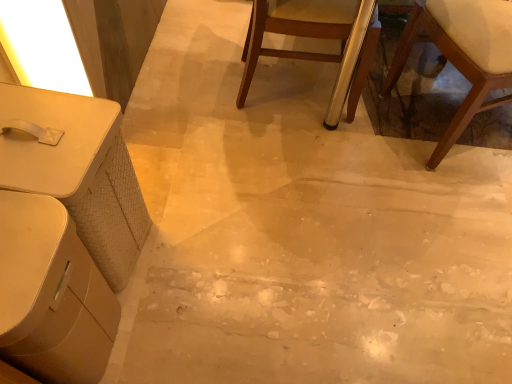
Locate an element on the screen. The height and width of the screenshot is (384, 512). wooden chair at center, marked as the 1th chair in a left-to-right arrangement is located at coordinates (295, 30).

What do you see at coordinates (78, 171) in the screenshot?
I see `white matte table at left, which is counted as the 1th table, starting from the top` at bounding box center [78, 171].

You are a GUI agent. You are given a task and a screenshot of the screen. Output one action in this format:
    pyautogui.click(x=<x>, y=<y>)
    Task: Click on the white matte table at left, which is counted as the 1th table, starting from the top
    This screenshot has height=384, width=512.
    Given the screenshot: What is the action you would take?
    pyautogui.click(x=78, y=171)

Locate an element on the screen. white glossy table at lower left, the second table positioned from the top is located at coordinates (51, 294).

In order to face white glossy table at lower left, the second table positioned from the top, should I rotate leftwards or rightwards?

To align with it, rotate left about 30.422°.

You are a GUI agent. You are given a task and a screenshot of the screen. Output one action in this format:
    pyautogui.click(x=<x>, y=<y>)
    Task: Click on the wooden chair at center, marked as the 1th chair in a left-to-right arrangement
    
    Given the screenshot: What is the action you would take?
    pyautogui.click(x=295, y=30)

Is wooden chair with white cushion at lower right, which is counted as the second chair, starting from the left, in contact with white matte table at left, the second table positioned from the bottom?

No, wooden chair with white cushion at lower right, which is counted as the second chair, starting from the left, is not next to white matte table at left, the second table positioned from the bottom.

Considering the sizes of objects wooden chair with white cushion at lower right, which is counted as the second chair, starting from the left, and white matte table at left, the second table positioned from the bottom, in the image provided, who is smaller, wooden chair with white cushion at lower right, which is counted as the second chair, starting from the left, or white matte table at left, the second table positioned from the bottom,?

Smaller between the two is white matte table at left, the second table positioned from the bottom.

Looking at this image, how different are the orientations of wooden chair with white cushion at lower right, positioned as the first chair in right-to-left order, and white matte table at left, which is counted as the 1th table, starting from the top, in degrees?

The angle between the facing direction of wooden chair with white cushion at lower right, positioned as the first chair in right-to-left order, and the facing direction of white matte table at left, which is counted as the 1th table, starting from the top, is 151 degrees.

Considering the positions of points (402, 37) and (39, 92), is point (402, 37) farther from camera compared to point (39, 92)?

That is True.

Between white matte table at left, the second table positioned from the bottom, and wooden chair with white cushion at lower right, which is counted as the second chair, starting from the left, which one appears on the right side from the viewer's perspective?

wooden chair with white cushion at lower right, which is counted as the second chair, starting from the left.

What's the angular difference between white matte table at left, the second table positioned from the bottom, and wooden chair with white cushion at lower right, positioned as the first chair in right-to-left order,'s facing directions?

The angular difference between white matte table at left, the second table positioned from the bottom, and wooden chair with white cushion at lower right, positioned as the first chair in right-to-left order, is 151 degrees.

Looking at the image, does white matte table at left, the second table positioned from the bottom, seem bigger or smaller compared to wooden chair with white cushion at lower right, positioned as the first chair in right-to-left order?

white matte table at left, the second table positioned from the bottom, is smaller than wooden chair with white cushion at lower right, positioned as the first chair in right-to-left order.

In the scene shown: Is white matte table at left, which is counted as the 1th table, starting from the top, not inside wooden chair with white cushion at lower right, positioned as the first chair in right-to-left order?

Yes, white matte table at left, which is counted as the 1th table, starting from the top, is not within wooden chair with white cushion at lower right, positioned as the first chair in right-to-left order.

From a real-world perspective, is wooden chair with white cushion at lower right, which is counted as the second chair, starting from the left, positioned under wooden chair at center, the 2th chair when ordered from right to left, based on gravity?

No, from a real-world perspective, wooden chair with white cushion at lower right, which is counted as the second chair, starting from the left, is not below wooden chair at center, the 2th chair when ordered from right to left.

Based on the photo, is wooden chair with white cushion at lower right, which is counted as the second chair, starting from the left, not close to wooden chair at center, marked as the 1th chair in a left-to-right arrangement?

wooden chair with white cushion at lower right, which is counted as the second chair, starting from the left, is near wooden chair at center, marked as the 1th chair in a left-to-right arrangement, not far away.

Does point (468, 58) come behind point (341, 41)?

No.

From a real-world perspective, is white matte table at left, the second table positioned from the bottom, physically above white glossy table at lower left, the second table positioned from the top?

Actually, white matte table at left, the second table positioned from the bottom, is physically below white glossy table at lower left, the second table positioned from the top, in the real world.

Would you say white matte table at left, which is counted as the 1th table, starting from the top, contains white glossy table at lower left, arranged as the first table when ordered from the bottom?

That's incorrect, white glossy table at lower left, arranged as the first table when ordered from the bottom, is not inside white matte table at left, which is counted as the 1th table, starting from the top.

Is white matte table at left, which is counted as the 1th table, starting from the top, facing away from white glossy table at lower left, arranged as the first table when ordered from the bottom?

No.

Is point (34, 369) closer or farther from the camera than point (337, 19)?

Point (34, 369) is closer to the camera than point (337, 19).

Is white glossy table at lower left, arranged as the first table when ordered from the bottom, facing away from wooden chair at center, marked as the 1th chair in a left-to-right arrangement?

white glossy table at lower left, arranged as the first table when ordered from the bottom, is not turned away from wooden chair at center, marked as the 1th chair in a left-to-right arrangement.

Are white glossy table at lower left, the second table positioned from the top, and wooden chair at center, marked as the 1th chair in a left-to-right arrangement, far apart?

white glossy table at lower left, the second table positioned from the top, is positioned a significant distance from wooden chair at center, marked as the 1th chair in a left-to-right arrangement.

Considering the relative sizes of white glossy table at lower left, arranged as the first table when ordered from the bottom, and wooden chair at center, marked as the 1th chair in a left-to-right arrangement, in the image provided, is white glossy table at lower left, arranged as the first table when ordered from the bottom, shorter than wooden chair at center, marked as the 1th chair in a left-to-right arrangement,?

Indeed, white glossy table at lower left, arranged as the first table when ordered from the bottom, has a lesser height compared to wooden chair at center, marked as the 1th chair in a left-to-right arrangement.

Is wooden chair at center, marked as the 1th chair in a left-to-right arrangement, inside or outside of white glossy table at lower left, arranged as the first table when ordered from the bottom?

wooden chair at center, marked as the 1th chair in a left-to-right arrangement, is spatially situated outside white glossy table at lower left, arranged as the first table when ordered from the bottom.

From a real-world perspective, which object stands above the other?

In real-world perspective, wooden chair at center, the 2th chair when ordered from right to left, is above.

Is wooden chair at center, marked as the 1th chair in a left-to-right arrangement, facing towards white glossy table at lower left, arranged as the first table when ordered from the bottom?

No, wooden chair at center, marked as the 1th chair in a left-to-right arrangement, is not aimed at white glossy table at lower left, arranged as the first table when ordered from the bottom.

Between point (64, 269) and point (462, 57), which one is positioned in front?

The point (64, 269) is closer to the camera.

From a real-world perspective, which is physically above, white glossy table at lower left, the second table positioned from the top, or wooden chair with white cushion at lower right, which is counted as the second chair, starting from the left?

wooden chair with white cushion at lower right, which is counted as the second chair, starting from the left, is physically above.

Could you tell me if white glossy table at lower left, the second table positioned from the top, is turned towards wooden chair with white cushion at lower right, which is counted as the second chair, starting from the left?

No, white glossy table at lower left, the second table positioned from the top, is not facing towards wooden chair with white cushion at lower right, which is counted as the second chair, starting from the left.

From the white matte table at left, the second table positioned from the bottom, count 2nd chair to the right and point to it. Please provide its 2D coordinates.

[(461, 54)]

Identify the location of chair that is the 1st one when counting backward from the white matte table at left, which is counted as the 1th table, starting from the top. (461, 54).

Looking at the image, which one is located closer to wooden chair at center, marked as the 1th chair in a left-to-right arrangement, white matte table at left, the second table positioned from the bottom, or wooden chair with white cushion at lower right, positioned as the first chair in right-to-left order?

wooden chair with white cushion at lower right, positioned as the first chair in right-to-left order.

Which object lies further to the anchor point wooden chair with white cushion at lower right, which is counted as the second chair, starting from the left, white matte table at left, the second table positioned from the bottom, or white glossy table at lower left, the second table positioned from the top?

Based on the image, white glossy table at lower left, the second table positioned from the top, appears to be further to wooden chair with white cushion at lower right, which is counted as the second chair, starting from the left.

Looking at this image, estimate the real-world distances between objects in this image. Which object is closer to white matte table at left, the second table positioned from the bottom, white glossy table at lower left, arranged as the first table when ordered from the bottom, or wooden chair at center, the 2th chair when ordered from right to left?

Based on the image, white glossy table at lower left, arranged as the first table when ordered from the bottom, appears to be nearer to white matte table at left, the second table positioned from the bottom.

Considering their positions, is wooden chair at center, marked as the 1th chair in a left-to-right arrangement, positioned further to wooden chair with white cushion at lower right, which is counted as the second chair, starting from the left, than white matte table at left, which is counted as the 1th table, starting from the top?

Based on the image, white matte table at left, which is counted as the 1th table, starting from the top, appears to be further to wooden chair with white cushion at lower right, which is counted as the second chair, starting from the left.

Looking at the image, which one is located further to white matte table at left, which is counted as the 1th table, starting from the top, white glossy table at lower left, the second table positioned from the top, or wooden chair with white cushion at lower right, positioned as the first chair in right-to-left order?

wooden chair with white cushion at lower right, positioned as the first chair in right-to-left order, is positioned further to the anchor white matte table at left, which is counted as the 1th table, starting from the top.

Estimate the real-world distances between objects in this image. Which object is closer to wooden chair with white cushion at lower right, which is counted as the second chair, starting from the left, white glossy table at lower left, the second table positioned from the top, or white matte table at left, the second table positioned from the bottom?

white matte table at left, the second table positioned from the bottom, is positioned closer to the anchor wooden chair with white cushion at lower right, which is counted as the second chair, starting from the left.

Based on their spatial positions, is wooden chair at center, marked as the 1th chair in a left-to-right arrangement, or white glossy table at lower left, arranged as the first table when ordered from the bottom, further from wooden chair with white cushion at lower right, positioned as the first chair in right-to-left order?

white glossy table at lower left, arranged as the first table when ordered from the bottom, lies further to wooden chair with white cushion at lower right, positioned as the first chair in right-to-left order, than the other object.

When comparing their distances from wooden chair at center, the 2th chair when ordered from right to left, does white matte table at left, which is counted as the 1th table, starting from the top, or white glossy table at lower left, arranged as the first table when ordered from the bottom, seem closer?

white matte table at left, which is counted as the 1th table, starting from the top, is positioned closer to the anchor wooden chair at center, the 2th chair when ordered from right to left.

The image size is (512, 384). In order to click on table between white glossy table at lower left, arranged as the first table when ordered from the bottom, and wooden chair with white cushion at lower right, which is counted as the second chair, starting from the left, from left to right in this screenshot , I will do `click(78, 171)`.

The width and height of the screenshot is (512, 384). Identify the location of chair situated between white matte table at left, the second table positioned from the bottom, and wooden chair with white cushion at lower right, positioned as the first chair in right-to-left order, from left to right. [x=295, y=30].

Identify the location of table between wooden chair at center, the 2th chair when ordered from right to left, and white glossy table at lower left, arranged as the first table when ordered from the bottom, in the vertical direction. click(x=78, y=171).

Locate an element on the screen. This screenshot has height=384, width=512. chair located between white glossy table at lower left, the second table positioned from the top, and wooden chair with white cushion at lower right, which is counted as the second chair, starting from the left, in the left-right direction is located at coordinates (295, 30).